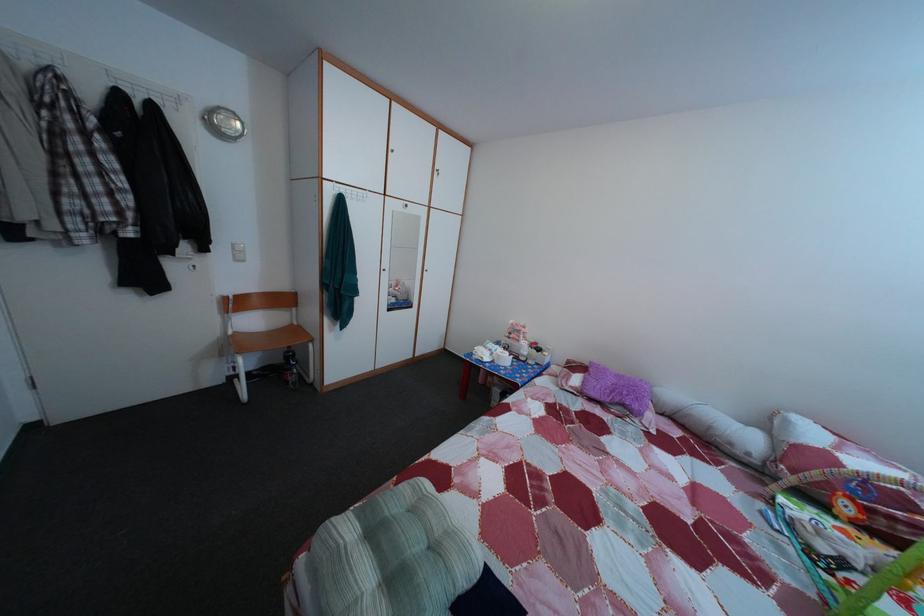
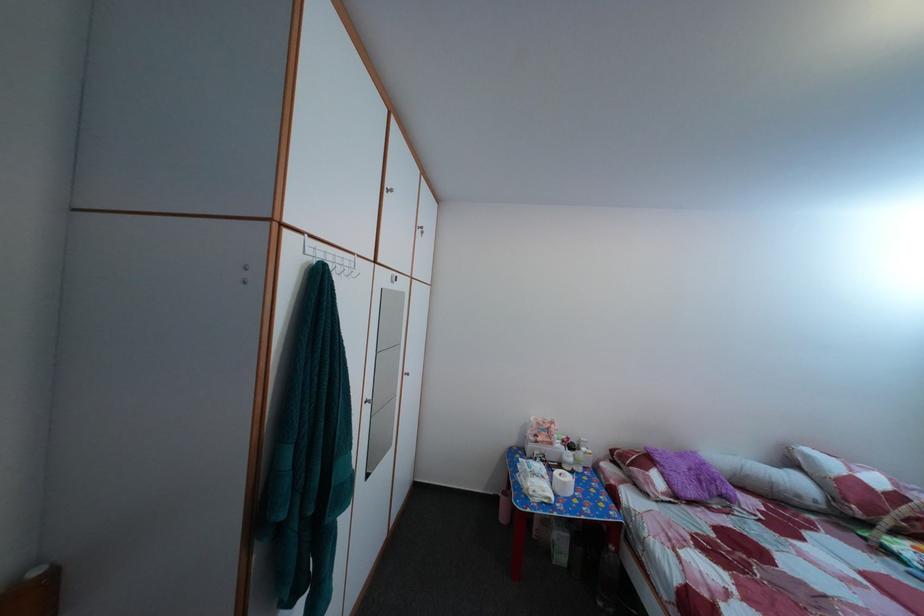
In the second image, find the point that corresponds to point (739, 452) in the first image.

(808, 504)